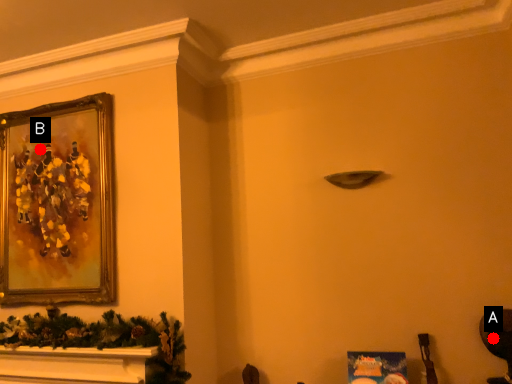
Question: Two points are circled on the image, labeled by A and B beside each circle. Among these points, which one is nearest to the camera?

Choices:
 (A) A is closer
 (B) B is closer

Answer: (A)